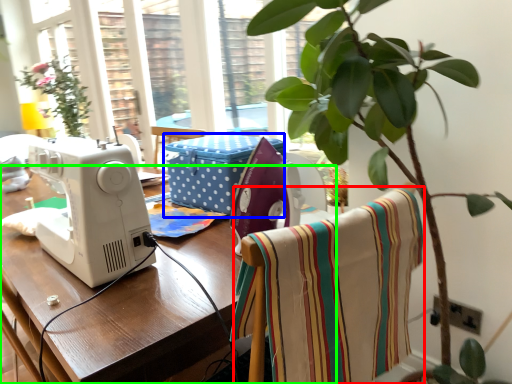
Question: Which object is positioned closest to blanket (highlighted by a red box)? Select from box (highlighted by a blue box) and table (highlighted by a green box).

Choices:
 (A) box
 (B) table

Answer: (B)